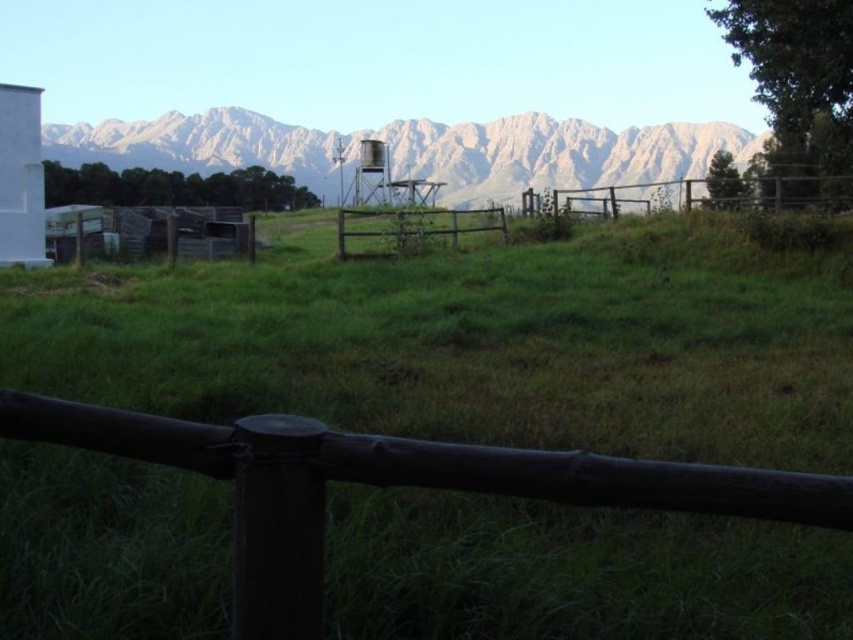
Question: Which object is closer to the camera taking this photo?

Choices:
 (A) metallic gray water tower at center
 (B) dark wood fence at center
 (C) gray rocky mountain range at upper center

Answer: (B)

Question: Is gray rocky mountain range at upper center closer to the viewer compared to metallic gray water tower at center?

Choices:
 (A) no
 (B) yes

Answer: (A)

Question: Which of the following is the farthest from the observer?

Choices:
 (A) (376, 179)
 (B) (648, 481)

Answer: (A)

Question: Does gray rocky mountain range at upper center appear over metallic gray water tower at center?

Choices:
 (A) yes
 (B) no

Answer: (A)

Question: Does gray rocky mountain range at upper center have a greater width compared to metallic gray water tower at center?

Choices:
 (A) no
 (B) yes

Answer: (B)

Question: Which point is closer to the camera taking this photo?

Choices:
 (A) (115, 150)
 (B) (576, 460)

Answer: (B)